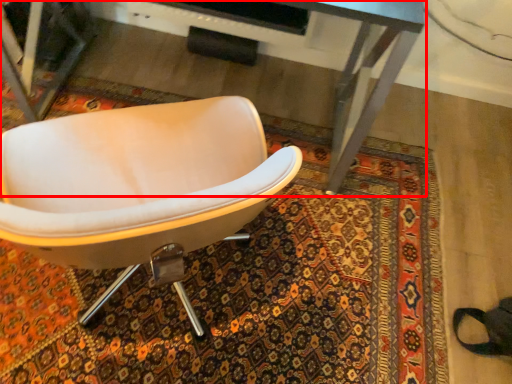
Question: From the image's perspective, what is the correct spatial positioning of desk (annotated by the red box) in reference to chair?

Choices:
 (A) below
 (B) above

Answer: (B)